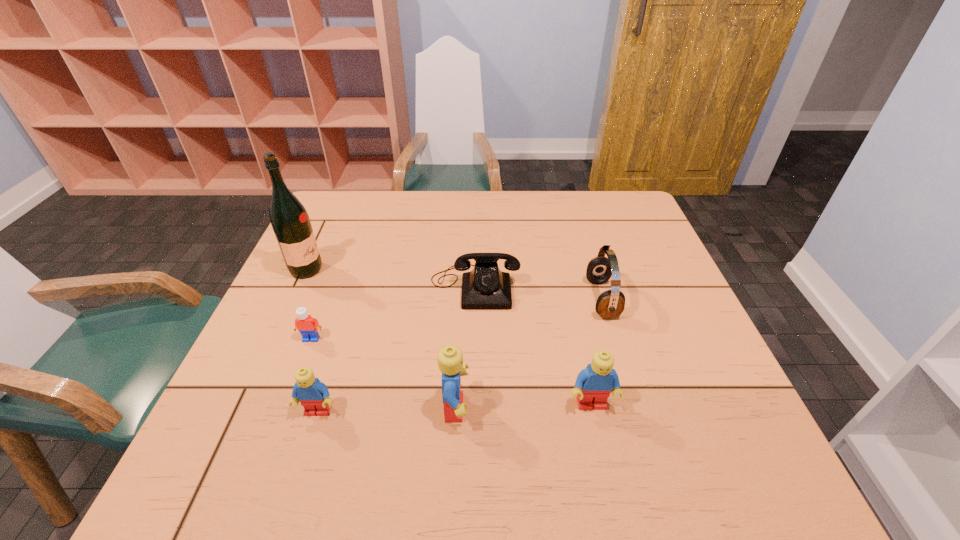
You are a GUI agent. You are given a task and a screenshot of the screen. Output one action in this format:
    pyautogui.click(x=<x>, y=<y>)
    Task: Click on the third tallest Lego
    This screenshot has height=540, width=960.
    Given the screenshot: What is the action you would take?
    pyautogui.click(x=314, y=396)

You are a GUI agent. You are given a task and a screenshot of the screen. Output one action in this format:
    pyautogui.click(x=<x>, y=<y>)
    Task: Click on the third Lego from left to right
    This screenshot has height=540, width=960.
    Given the screenshot: What is the action you would take?
    pyautogui.click(x=450, y=358)

You are a GUI agent. You are given a task and a screenshot of the screen. Output one action in this format:
    pyautogui.click(x=<x>, y=<y>)
    Task: Click on the second object from right to left
    
    Given the screenshot: What is the action you would take?
    pyautogui.click(x=594, y=384)

Find the location of a particular element. This screenshot has height=540, width=960. the third shortest Lego is located at coordinates (594, 384).

Identify the location of the leftmost object. point(290,221).

Locate an element on the screen. liquor is located at coordinates (290, 221).

The image size is (960, 540). Identify the location of the rightmost object. (610, 304).

Where is `telephone`? This screenshot has height=540, width=960. telephone is located at coordinates (486, 287).

Where is `the fourth farthest object`? This screenshot has width=960, height=540. the fourth farthest object is located at coordinates (308, 327).

Where is `the farthest Lego`? the farthest Lego is located at coordinates (308, 327).